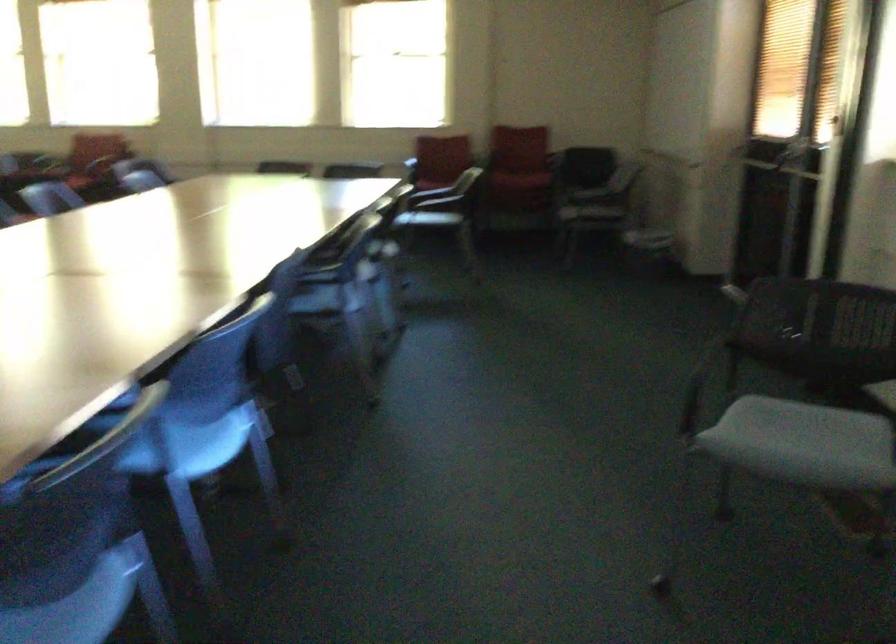
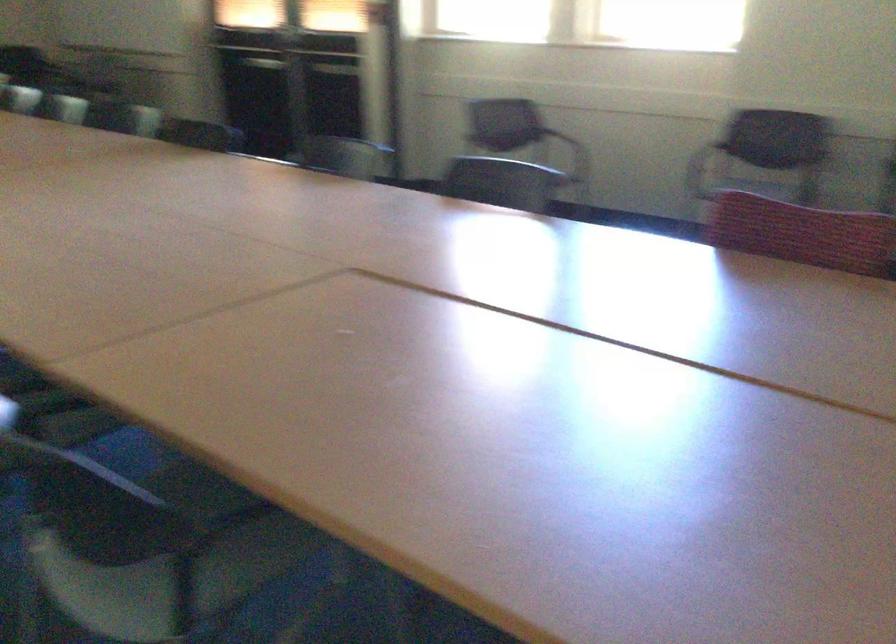
Question: I am providing you with two images of the same scene from different viewpoints. Which of the following objects are not visible in image2?

Choices:
 (A) black chair armrest
 (B) green clothes hanger
 (C) black chair sitting surface
 (D) blue chair sitting surface

Answer: (D)